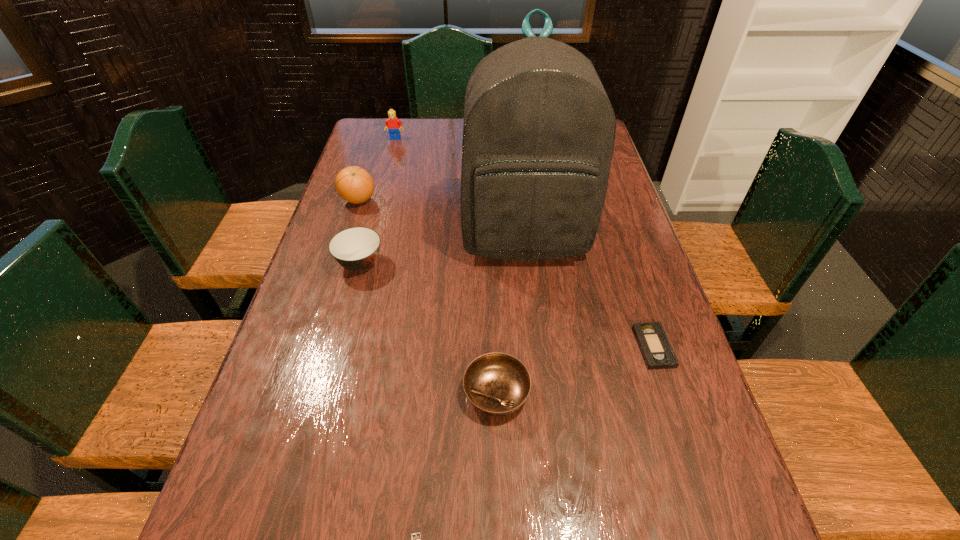
This screenshot has width=960, height=540. In order to click on empty space between the right soup bowl and the backpack in this screenshot , I will do `click(511, 315)`.

Identify the location of vacant space in between the tallest object and the Lego. (460, 188).

This screenshot has height=540, width=960. Identify the location of empty location between the rightmost object and the orange. (506, 273).

Locate which object ranks in proximity to the fourth object from right to left. Please provide its 2D coordinates. Your answer should be formatted as a tuple, i.e. [(x, y)], where the tuple contains the x and y coordinates of a point satisfying the conditions above.

[(497, 384)]

The image size is (960, 540). Find the location of `object identified as the second closest to the fourth shortest object`. object identified as the second closest to the fourth shortest object is located at coordinates (538, 134).

This screenshot has width=960, height=540. Find the location of `free location that satisfies the following two spatial constraints: 1. on the face of the shorter soup bowl; 2. on the left side of the farthest object`. free location that satisfies the following two spatial constraints: 1. on the face of the shorter soup bowl; 2. on the left side of the farthest object is located at coordinates (327, 393).